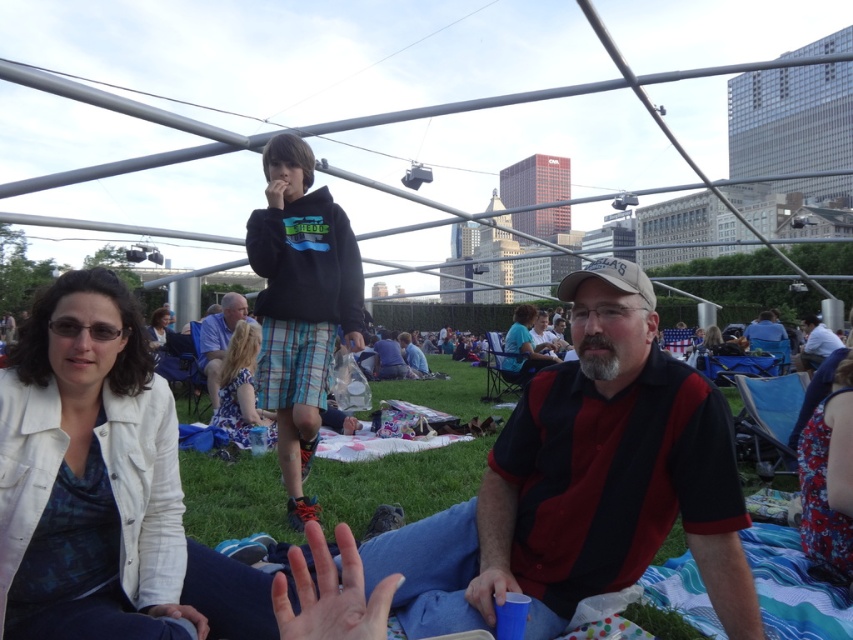
Who is taller, reddish-brown cotton polo shirt at center or dark blue jeans at center?

Standing taller between the two is reddish-brown cotton polo shirt at center.

In the scene shown: Who is shorter, reddish-brown cotton polo shirt at center or dark blue jeans at center?

Standing shorter between the two is dark blue jeans at center.

Who is more distant from viewer, (624, 330) or (389, 355)?

The point (389, 355) is behind.

In order to click on reddish-brown cotton polo shirt at center in this screenshot , I will do `click(584, 483)`.

Between matte blue shirt at center and white cotton shirt at center, which one is positioned higher?

white cotton shirt at center is above.

Who is more forward, (515, 358) or (811, 355)?

Point (515, 358) is more forward.

The width and height of the screenshot is (853, 640). In order to click on matte blue shirt at center in this screenshot , I will do `click(521, 348)`.

The height and width of the screenshot is (640, 853). Find the location of `matte blue shirt at center`. matte blue shirt at center is located at coordinates 521,348.

Which is below, white cotton jacket at lower left or matte blue shirt at center?

white cotton jacket at lower left is lower down.

Which is above, white cotton jacket at lower left or matte blue shirt at center?

matte blue shirt at center

Where is `white cotton jacket at lower left`? The image size is (853, 640). white cotton jacket at lower left is located at coordinates (102, 486).